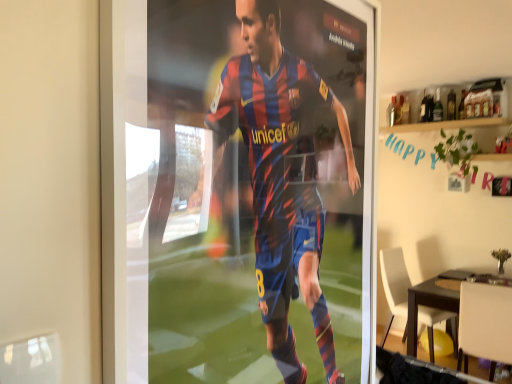
Question: Is white matte chair at lower right, which appears as the first chair when viewed from the front, bigger than white plastic chair at lower right, arranged as the first chair when viewed from the back?

Choices:
 (A) no
 (B) yes

Answer: (A)

Question: Could you tell me if white matte chair at lower right, which appears as the first chair when viewed from the front, is turned towards white plastic chair at lower right, arranged as the first chair when viewed from the back?

Choices:
 (A) yes
 (B) no

Answer: (B)

Question: From the image's perspective, is white matte chair at lower right, which ranks as the 2th chair in back-to-front order, located above white plastic chair at lower right, the 2th chair from the front?

Choices:
 (A) yes
 (B) no

Answer: (B)

Question: Does white matte chair at lower right, which ranks as the 2th chair in back-to-front order, have a greater width compared to white plastic chair at lower right, arranged as the first chair when viewed from the back?

Choices:
 (A) no
 (B) yes

Answer: (B)

Question: Is white matte chair at lower right, which ranks as the 2th chair in back-to-front order, next to white plastic chair at lower right, arranged as the first chair when viewed from the back, and touching it?

Choices:
 (A) no
 (B) yes

Answer: (A)

Question: Is point (431, 359) closer or farther from the camera than point (504, 332)?

Choices:
 (A) closer
 (B) farther

Answer: (B)

Question: Considering the positions of dark brown wooden table at lower right and white matte chair at lower right, which ranks as the 2th chair in back-to-front order, in the image, is dark brown wooden table at lower right taller or shorter than white matte chair at lower right, which ranks as the 2th chair in back-to-front order,?

Choices:
 (A) short
 (B) tall

Answer: (A)

Question: From the image's perspective, is dark brown wooden table at lower right located above or below white matte chair at lower right, which ranks as the 2th chair in back-to-front order?

Choices:
 (A) below
 (B) above

Answer: (A)

Question: Considering their positions, is dark brown wooden table at lower right located in front of or behind white matte chair at lower right, which ranks as the 2th chair in back-to-front order?

Choices:
 (A) behind
 (B) front

Answer: (A)

Question: Is point (461, 289) closer or farther from the camera than point (407, 271)?

Choices:
 (A) closer
 (B) farther

Answer: (A)

Question: Is white matte chair at lower right, which ranks as the 2th chair in back-to-front order, taller or shorter than white plastic chair at lower right, the 2th chair from the front?

Choices:
 (A) tall
 (B) short

Answer: (B)

Question: Based on their sizes in the image, would you say white matte chair at lower right, which appears as the first chair when viewed from the front, is bigger or smaller than white plastic chair at lower right, the 2th chair from the front?

Choices:
 (A) big
 (B) small

Answer: (B)

Question: Based on their positions, is white matte chair at lower right, which ranks as the 2th chair in back-to-front order, located to the left or right of white plastic chair at lower right, arranged as the first chair when viewed from the back?

Choices:
 (A) right
 (B) left

Answer: (A)

Question: From a real-world perspective, is white plastic chair at lower right, the 2th chair from the front, positioned above or below white matte chair at lower right, which ranks as the 2th chair in back-to-front order?

Choices:
 (A) above
 (B) below

Answer: (B)

Question: Relative to white matte chair at lower right, which ranks as the 2th chair in back-to-front order, is white plastic chair at lower right, arranged as the first chair when viewed from the back, in front or behind?

Choices:
 (A) front
 (B) behind

Answer: (B)